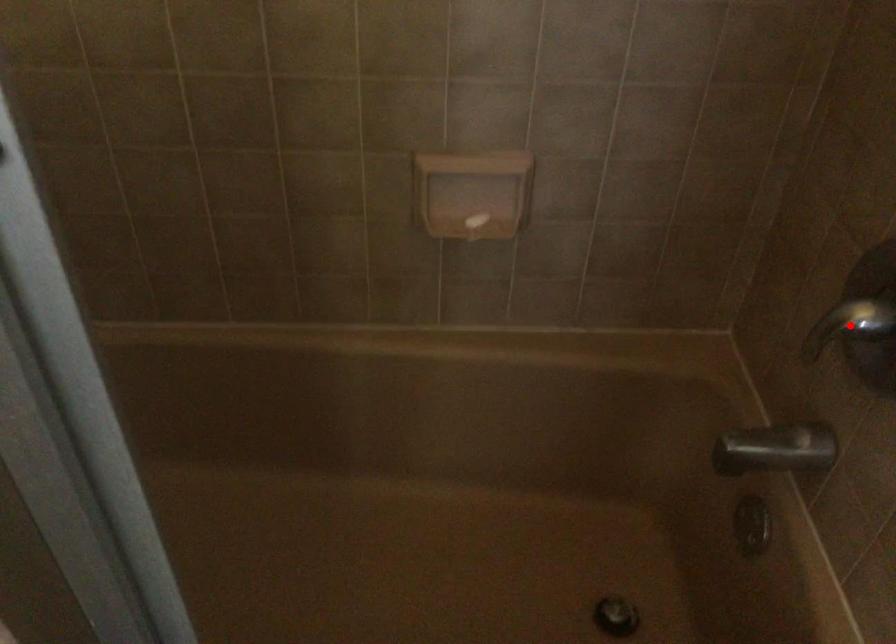
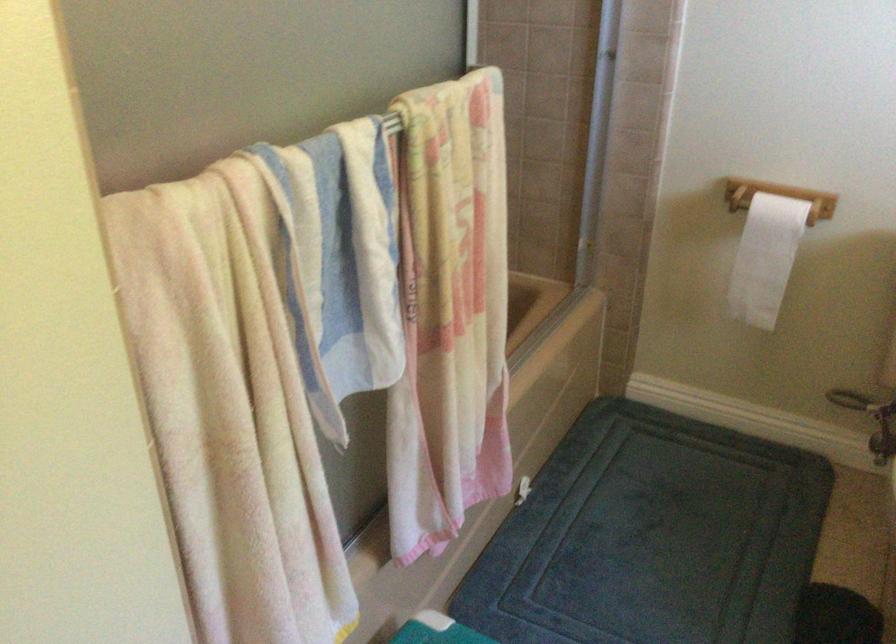
Question: I am providing you with two images of the same scene from different viewpoints. A red point is marked on the first image. Can you still see the location of the red point in image 2?

Choices:
 (A) Yes
 (B) No

Answer: (B)